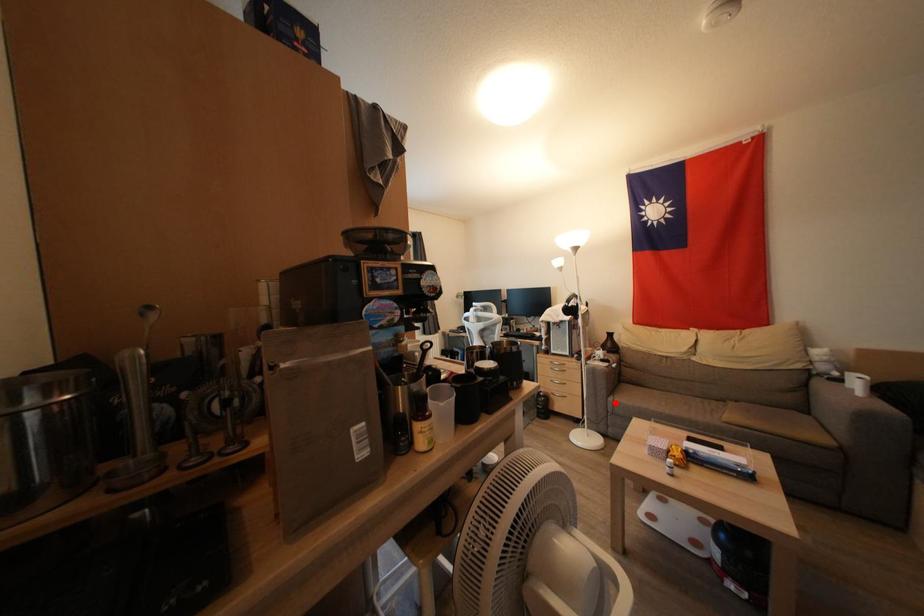
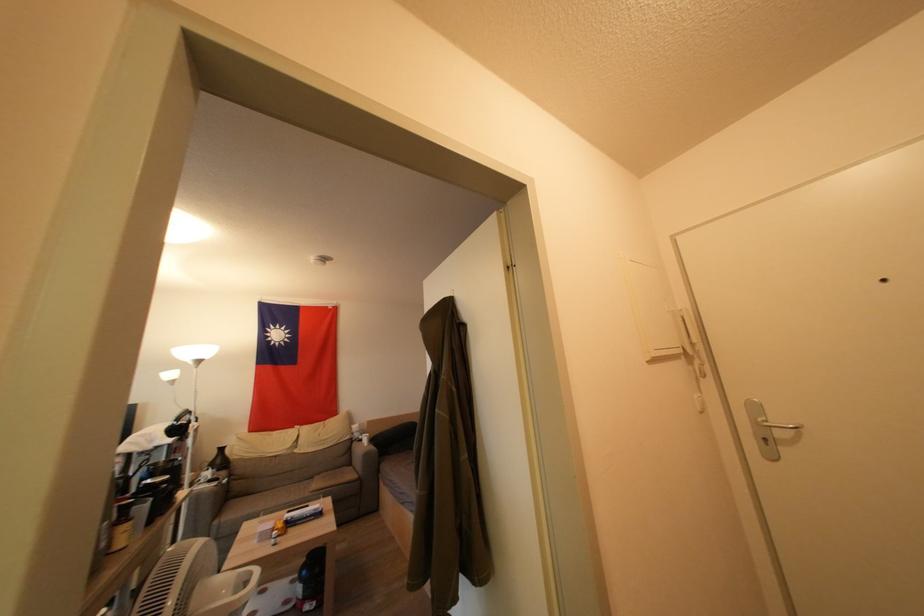
Question: I am providing you with two images of the same scene from different viewpoints. Image1 has a red point marked. In image2, the corresponding 3D location appears at what relative position? Reply with the corresponding letter.

Choices:
 (A) Closer
 (B) Farther

Answer: (A)